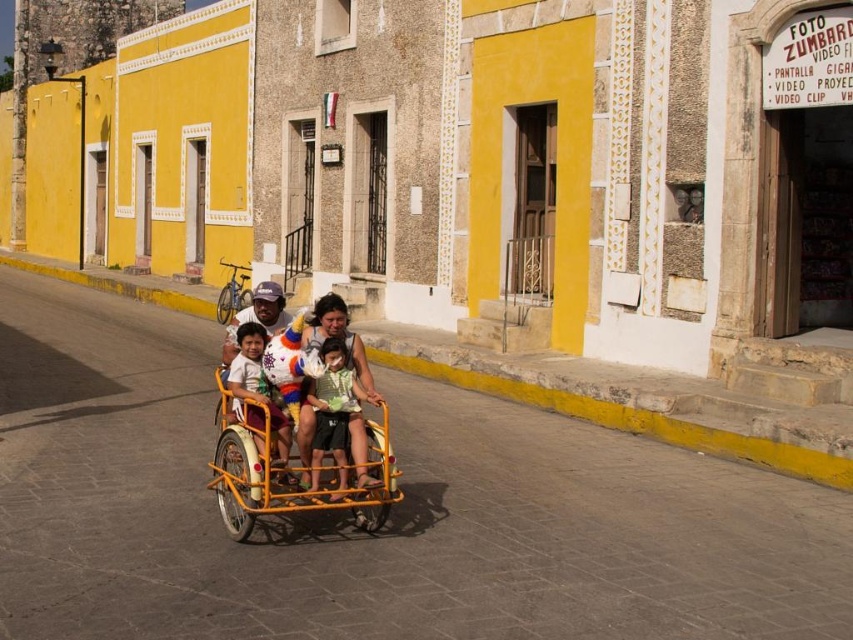
Can you confirm if yellow matte wagon at center is positioned to the left of yellow metallic tricycle at center?

Correct, you'll find yellow matte wagon at center to the left of yellow metallic tricycle at center.

Between point (258, 476) and point (227, 358), which one is positioned in front?

Point (258, 476) is in front.

You are a GUI agent. You are given a task and a screenshot of the screen. Output one action in this format:
    pyautogui.click(x=<x>, y=<y>)
    Task: Click on the yellow matte wagon at center
    
    Given the screenshot: What is the action you would take?
    pyautogui.click(x=291, y=474)

Describe the element at coordinates (338, 419) in the screenshot. I see `matte green shirt at center` at that location.

Is point (326, 340) more distant than point (274, 438)?

That is False.

Where is `matte green shirt at center`? The image size is (853, 640). matte green shirt at center is located at coordinates (338, 419).

Is yellow metallic tricycle at center closer to camera compared to matte green shirt at center?

That is True.

Find the location of a particular element. yellow metallic tricycle at center is located at coordinates (312, 364).

Where is `yellow metallic tricycle at center`? The width and height of the screenshot is (853, 640). yellow metallic tricycle at center is located at coordinates (312, 364).